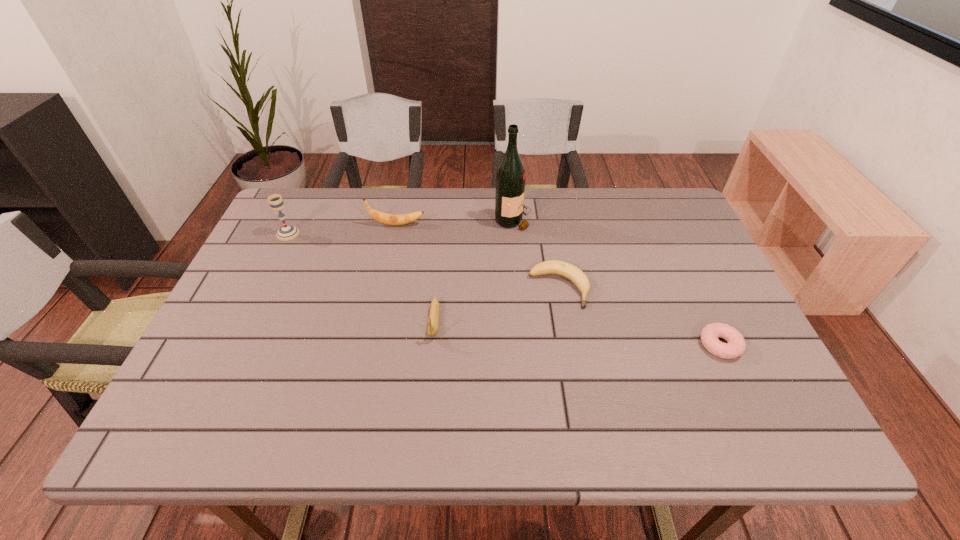
I want to click on vacant region between the chalice and the shortest object, so click(x=504, y=289).

Image resolution: width=960 pixels, height=540 pixels. I want to click on free space that is in between the shortest banana and the fifth object from right to left, so click(x=478, y=256).

At what (x,y) coordinates should I click in order to perform the action: click on empty space that is in between the doughnut and the tallest object. Please return your answer as a coordinate pair (x, y). Image resolution: width=960 pixels, height=540 pixels. Looking at the image, I should click on (616, 282).

Image resolution: width=960 pixels, height=540 pixels. What are the coordinates of `free spot between the rightmost banana and the tallest object` in the screenshot? It's located at (536, 254).

What are the coordinates of `free area in between the chalice and the leftmost banana` in the screenshot? It's located at (343, 229).

This screenshot has width=960, height=540. Identify the location of free space between the second tallest object and the wine bottle. (400, 227).

Locate an element on the screen. The height and width of the screenshot is (540, 960). free space between the chalice and the third tallest object is located at coordinates (343, 229).

Locate an element on the screen. Image resolution: width=960 pixels, height=540 pixels. object that stands as the third closest to the wine bottle is located at coordinates (x=433, y=320).

Locate which object is the closest to the third tallest object. Please provide its 2D coordinates. Your answer should be formatted as a tuple, i.e. [(x, y)], where the tuple contains the x and y coordinates of a point satisfying the conditions above.

[(287, 232)]

Identify which banana is the closest to the shortest banana. Please provide its 2D coordinates. Your answer should be formatted as a tuple, i.e. [(x, y)], where the tuple contains the x and y coordinates of a point satisfying the conditions above.

[(433, 320)]